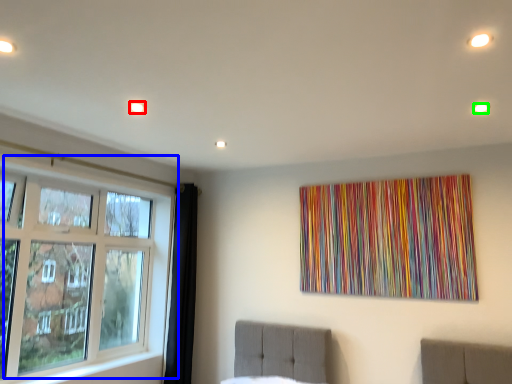
Question: Which is nearer to the light (highlighted by a red box)? window (highlighted by a blue box) or light (highlighted by a green box).

Choices:
 (A) window
 (B) light

Answer: (A)